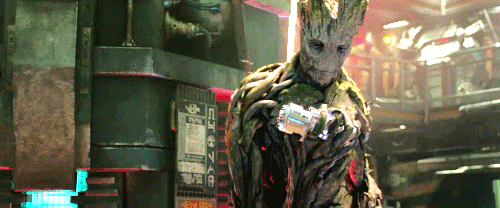
This screenshot has width=500, height=208. Find the location of `light`. light is located at coordinates (53, 206).